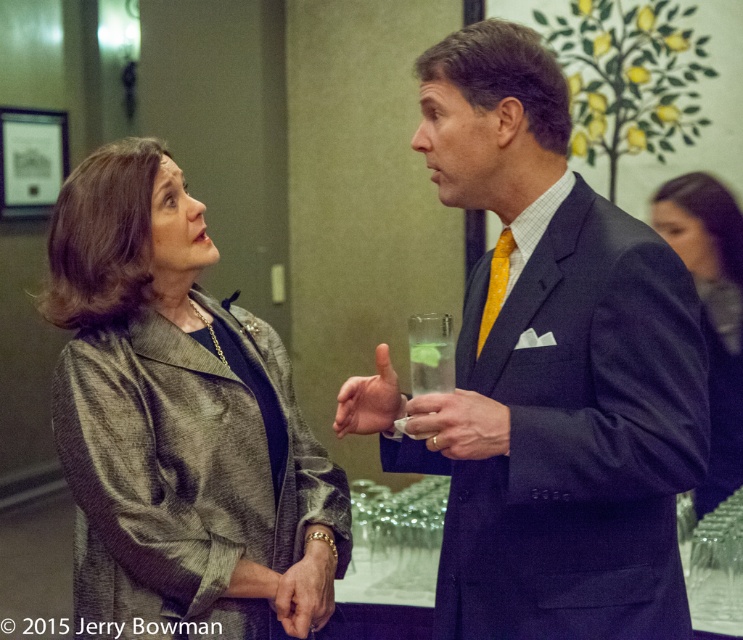
Question: Does matte gray blazer at center appear under yellow satin tie at right?

Choices:
 (A) yes
 (B) no

Answer: (A)

Question: Does matte plastic cup at center appear on the right side of smooth skin hand at center?

Choices:
 (A) no
 (B) yes

Answer: (B)

Question: Which of these objects is positioned closest to the smooth skin hand at center?

Choices:
 (A) matte plastic cup at center
 (B) leather bracelet at lower center
 (C) matte black suit at center
 (D) dark blue fabric jacket at right

Answer: (A)

Question: Does matte gray blazer at center have a greater width compared to matte plastic cup at center?

Choices:
 (A) no
 (B) yes

Answer: (B)

Question: Among these points, which one is nearest to the camera?

Choices:
 (A) (438, 433)
 (B) (398, 438)

Answer: (A)

Question: Which object is closer to the camera taking this photo?

Choices:
 (A) dark blue fabric jacket at right
 (B) yellow satin tie at right
 (C) leather bracelet at lower center

Answer: (B)